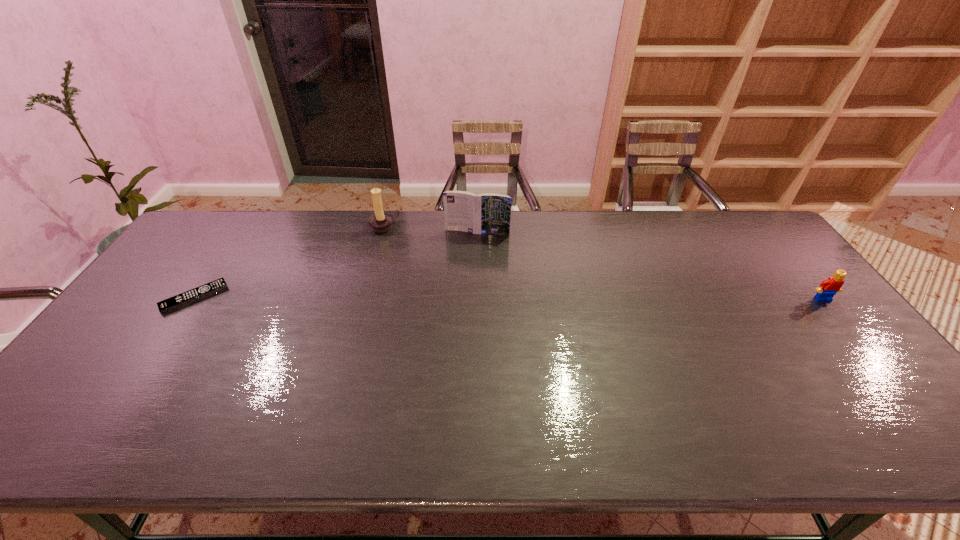
The image size is (960, 540). In order to click on free space at the left edge of the desktop in this screenshot , I will do click(171, 294).

The height and width of the screenshot is (540, 960). Find the location of `vacant space at the right edge`. vacant space at the right edge is located at coordinates (834, 332).

In the image, there is a desktop. Identify the location of vacant space at the near left corner. Image resolution: width=960 pixels, height=540 pixels. (137, 380).

Find the location of `free space at the far right corner`. free space at the far right corner is located at coordinates (705, 210).

I want to click on free point between the Lego and the shortest object, so click(x=509, y=299).

Find the location of a particular element. This screenshot has width=960, height=540. vacant space that is in between the candle holder and the third object from left to right is located at coordinates (430, 229).

At what (x,y) coordinates should I click in order to perform the action: click on vacant space in between the second object from left to right and the remote control. Please return your answer as a coordinate pair (x, y). The image size is (960, 540). Looking at the image, I should click on (289, 262).

The width and height of the screenshot is (960, 540). Find the location of `vacant area that lies between the third object from left to right and the rightmost object`. vacant area that lies between the third object from left to right and the rightmost object is located at coordinates (650, 266).

Where is `vacant space in between the rightmost object and the second object from left to right`? vacant space in between the rightmost object and the second object from left to right is located at coordinates (603, 263).

Find the location of a particular element. The image size is (960, 540). vacant space in between the third object from left to right and the candle holder is located at coordinates (430, 229).